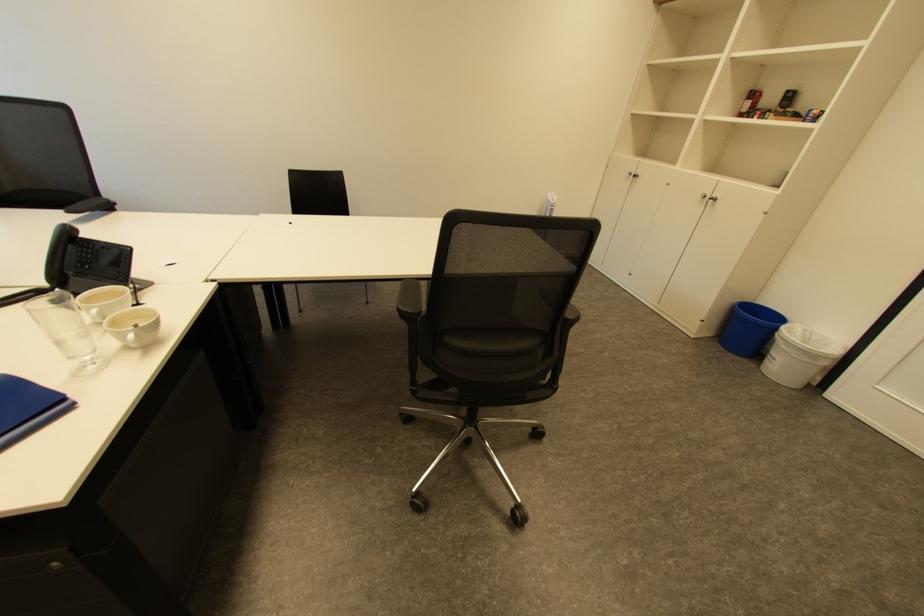
The height and width of the screenshot is (616, 924). I want to click on black chair sitting surface, so click(x=488, y=320).